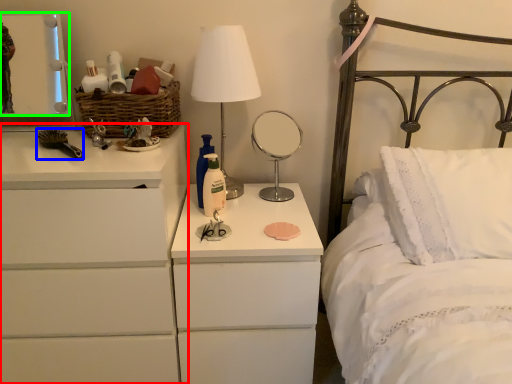
Question: Estimate the real-world distances between objects in this image. Which object is farther from chest of drawers (highlighted by a red box), brush (highlighted by a blue box) or mirror (highlighted by a green box)?

Choices:
 (A) brush
 (B) mirror

Answer: (B)